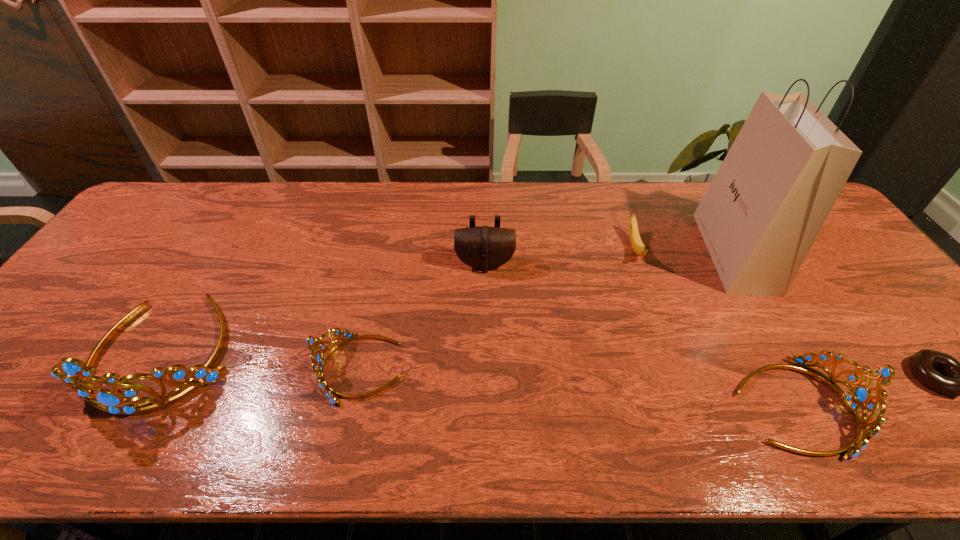
This screenshot has height=540, width=960. What are the coordinates of `vacant region located on the front-facing side of the sixth object from right to left` in the screenshot? It's located at (191, 369).

What are the coordinates of `vacant space positioned on the front-facing side of the sixth object from right to left` in the screenshot? It's located at (170, 369).

Image resolution: width=960 pixels, height=540 pixels. I want to click on blank space located on the front-facing side of the second tallest tiara, so click(879, 406).

Identify the location of vacant space situated at the stem of the fourth object from left to right. (657, 311).

In order to click on vacant region located 0.100m on the right of the shopping bag in this screenshot , I will do `click(798, 252)`.

Find the location of `vacant space located 0.230m with the flap open on the pouch`. vacant space located 0.230m with the flap open on the pouch is located at coordinates (486, 341).

This screenshot has height=540, width=960. I want to click on object present at the far edge, so click(x=762, y=212).

Where is `vacant space at the far edge of the desktop`? vacant space at the far edge of the desktop is located at coordinates (613, 208).

In the image, there is a desktop. Where is `free space at the near edge`? free space at the near edge is located at coordinates (374, 383).

Where is `free location at the near left corner of the desktop`? The image size is (960, 540). free location at the near left corner of the desktop is located at coordinates [x=14, y=388].